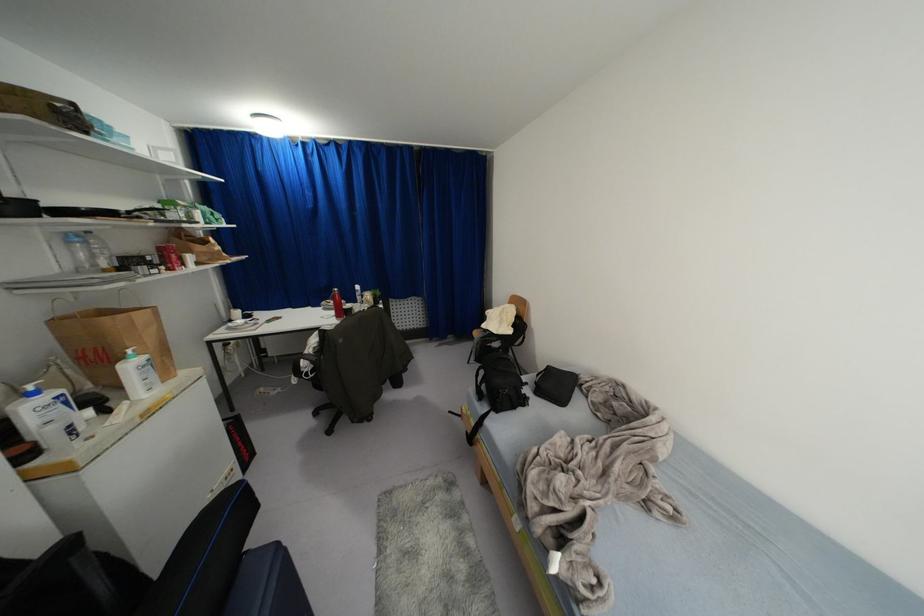
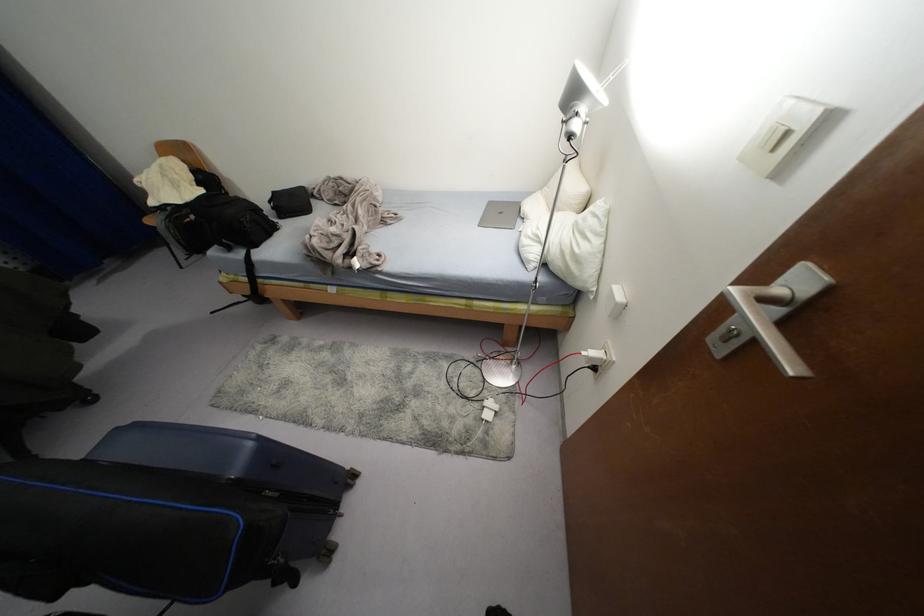
The point at (548, 367) is marked in the first image. Where is the corresponding point in the second image?

(274, 192)